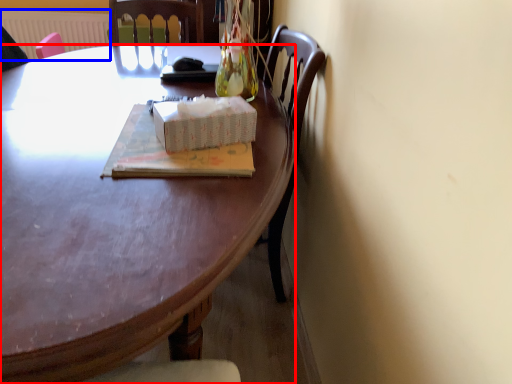
Question: Which object is closer to the camera taking this photo, desk (highlighted by a red box) or radiator (highlighted by a blue box)?

Choices:
 (A) desk
 (B) radiator

Answer: (A)